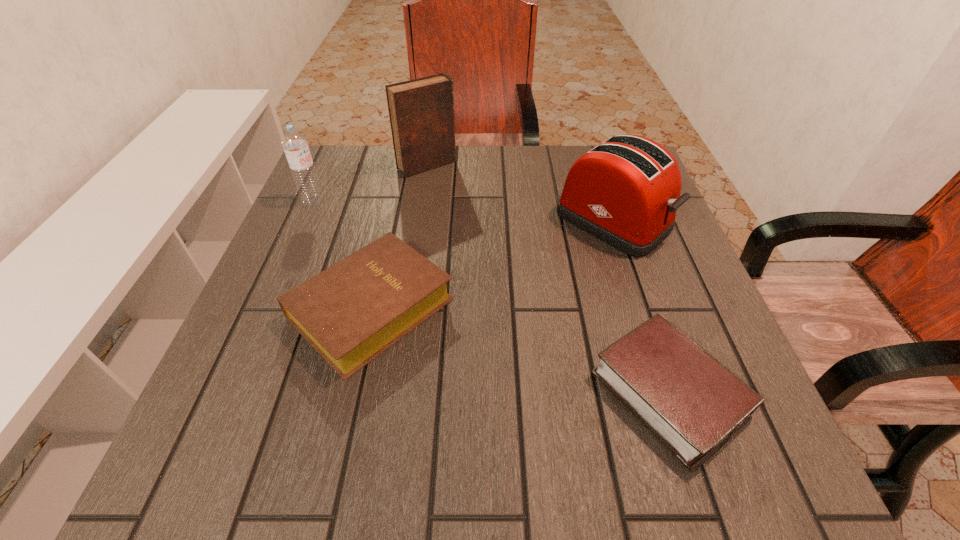
The height and width of the screenshot is (540, 960). I want to click on free space that is in between the rightmost Bible and the leftmost object, so click(492, 297).

Where is `unoccupied position between the toaster and the rightmost Bible`? unoccupied position between the toaster and the rightmost Bible is located at coordinates (641, 307).

Where is `vacant point located between the water bottle and the rightmost Bible`? vacant point located between the water bottle and the rightmost Bible is located at coordinates (492, 297).

Identify the location of free space between the leftmost object and the toaster. (463, 211).

The height and width of the screenshot is (540, 960). In order to click on blank region between the water bottle and the rightmost Bible in this screenshot , I will do `click(492, 297)`.

Locate an element on the screen. The height and width of the screenshot is (540, 960). object that stands as the fourth closest to the leftmost object is located at coordinates (692, 403).

I want to click on object that stands as the closest to the rightmost Bible, so click(626, 191).

I want to click on the third closest Bible to the leftmost object, so click(x=692, y=403).

Image resolution: width=960 pixels, height=540 pixels. What are the coordinates of `Bible that can be found as the second closest to the farthest Bible` in the screenshot? It's located at (692, 403).

You are a GUI agent. You are given a task and a screenshot of the screen. Output one action in this format:
    pyautogui.click(x=<x>, y=<y>)
    Task: Click on the vacant space that satisfies the following two spatial constraints: 1. on the front side of the water bottle; 2. on the right side of the toaster
    
    Given the screenshot: What is the action you would take?
    pyautogui.click(x=305, y=221)